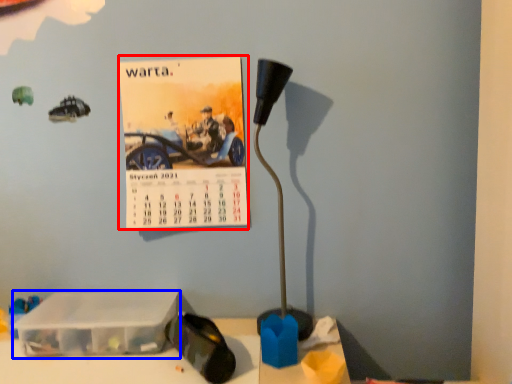
Question: Which of the following is the farthest to the observer, postcard (highlighted by a red box) or box (highlighted by a blue box)?

Choices:
 (A) postcard
 (B) box

Answer: (A)